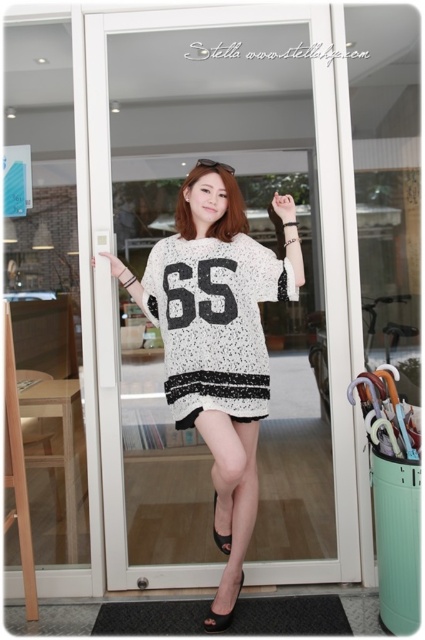
Between white dotted jersey at center and black suede sandal at lower center, which one has more height?

white dotted jersey at center

Where is `white dotted jersey at center`? The width and height of the screenshot is (425, 640). white dotted jersey at center is located at coordinates (214, 323).

The width and height of the screenshot is (425, 640). What are the coordinates of `white dotted jersey at center` in the screenshot? It's located at (214, 323).

Where is `white textured sweater at center`? white textured sweater at center is located at coordinates (218, 337).

Between white textured sweater at center and black leather sandal at lower center, which one is positioned higher?

white textured sweater at center is above.

Locate an element on the screen. The image size is (425, 640). white textured sweater at center is located at coordinates (218, 337).

Is point (192, 371) positioned behind point (229, 534)?

No, it is in front of (229, 534).

Which of these two, white dotted jersey at center or black leather sandal at lower center, stands taller?

white dotted jersey at center

Locate an element on the screen. This screenshot has width=425, height=640. white dotted jersey at center is located at coordinates (214, 323).

Identify the location of white dotted jersey at center. (214, 323).